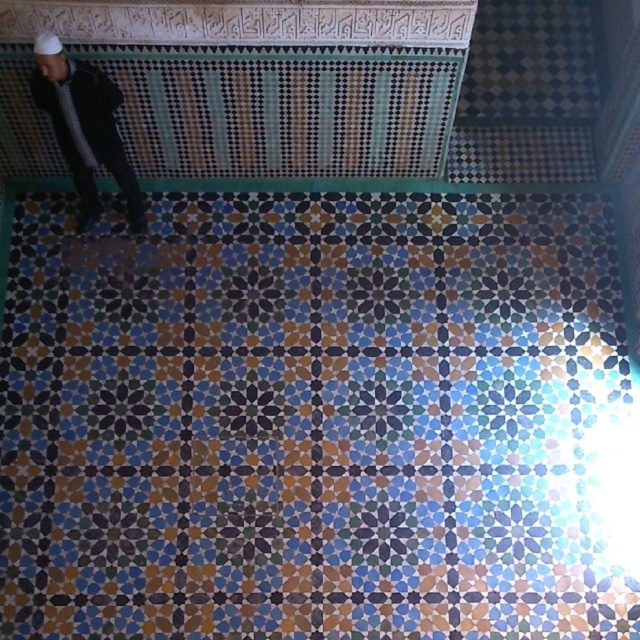
Question: Which point is farther from the camera taking this photo?

Choices:
 (A) (481, 216)
 (B) (86, 202)

Answer: (A)

Question: Can you confirm if mosaic tile at center is smaller than dark gray jacket at left?

Choices:
 (A) no
 (B) yes

Answer: (A)

Question: Is mosaic tile at center positioned behind dark gray jacket at left?

Choices:
 (A) yes
 (B) no

Answer: (A)

Question: Is the position of mosaic tile at center more distant than that of dark gray jacket at left?

Choices:
 (A) yes
 (B) no

Answer: (A)

Question: Which point is farther to the camera?

Choices:
 (A) (227, 472)
 (B) (116, 147)

Answer: (A)